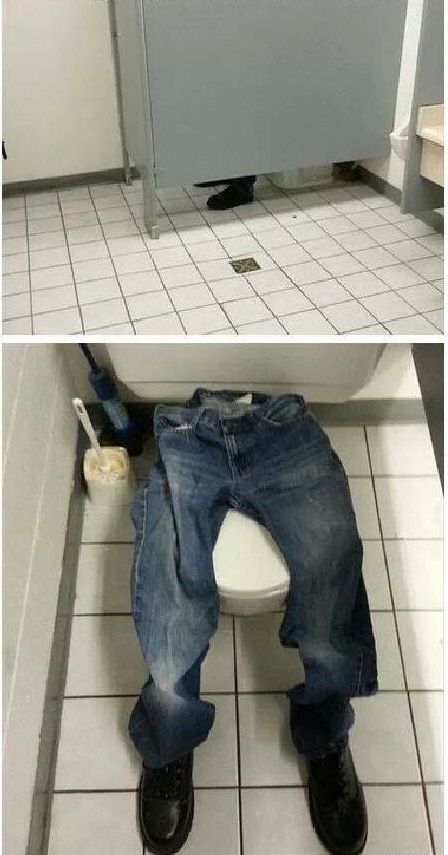
Show me where where you hold the toilet brush are located in the image. Your answer should be formatted as a list of tuples, i.e. [(x1, y1), (x2, y2), ...], where each tuple contains the x and y coordinates of a point satisfying the conditions above.

[(85, 425)]